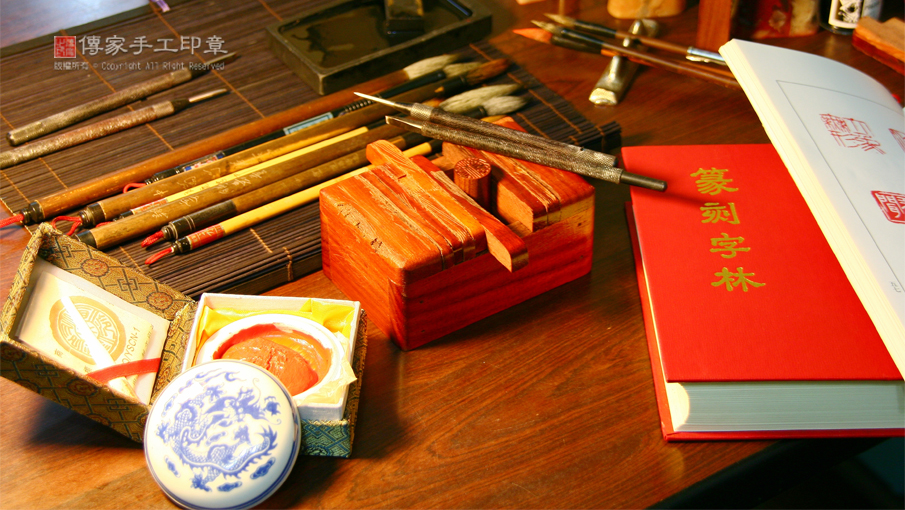
This screenshot has width=905, height=510. I want to click on wooden desk, so click(541, 433).